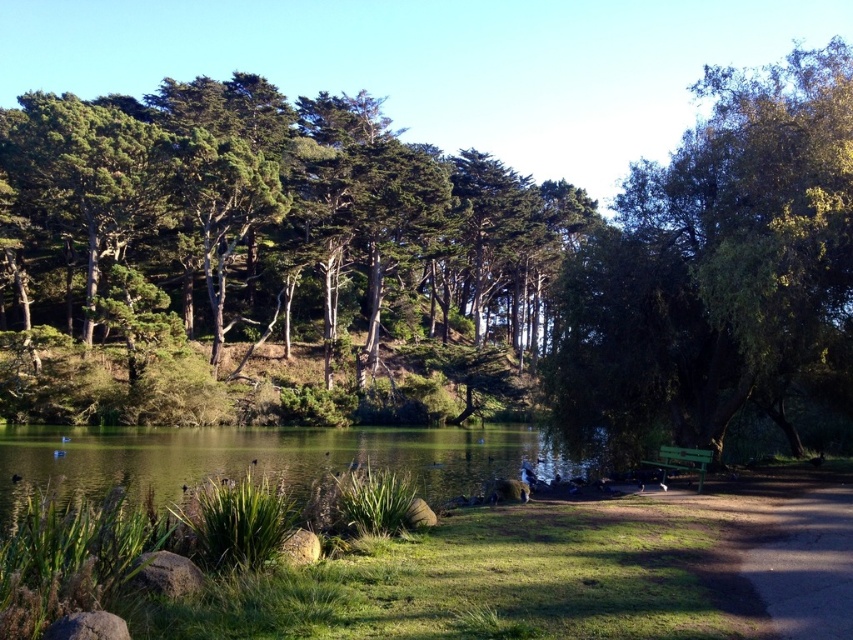
You are a photographer planning to capture the green textured trees at upper left and the green reflective water at center in a single shot. Considering their sizes in the frame, which object will appear larger in the photo?

The green textured trees at upper left will appear larger in the photo because they are much taller than the green reflective water at center.

You are standing at the point marked by the coordinates point [260,458] in the park. What is the closest object to you?

The closest object to you at point [260,458] is the green reflective water at center, as the coordinates correspond to its location.